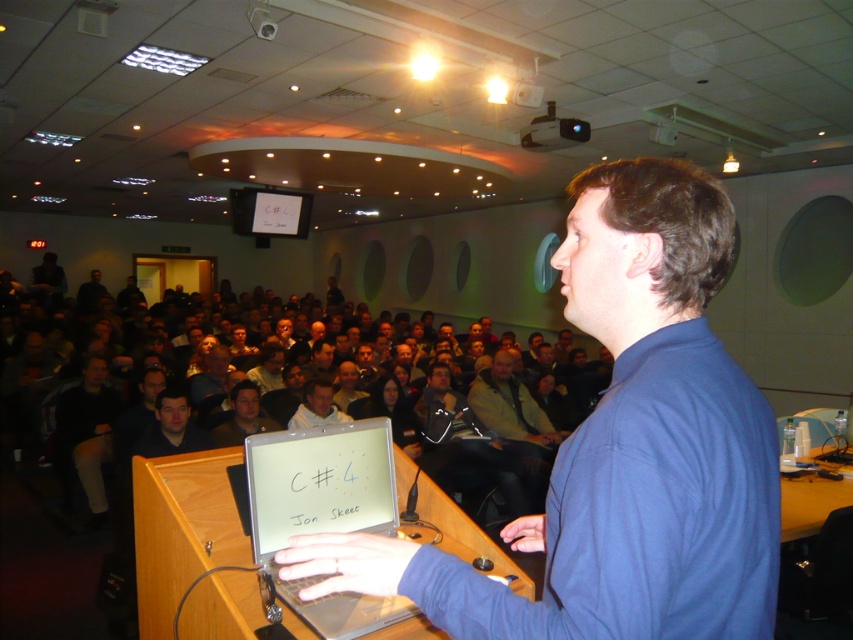
Is point (560, 342) positioned in front of point (254, 403)?

No, it is not.

Image resolution: width=853 pixels, height=640 pixels. Identify the location of dark gray fabric crowd at center. pyautogui.click(x=270, y=390).

Between dark brown hair at center and black plastic projector at upper center, which one has more height?

Standing taller between the two is black plastic projector at upper center.

Who is more distant from viewer, (213, 429) or (583, 132)?

Point (583, 132)

Locate an element on the screen. This screenshot has width=853, height=640. dark brown hair at center is located at coordinates (242, 417).

Who is lower down, blue fabric shirt at center or silver metallic laptop at center?

silver metallic laptop at center

Can you confirm if blue fabric shirt at center is bigger than silver metallic laptop at center?

Correct, blue fabric shirt at center is larger in size than silver metallic laptop at center.

In order to click on blue fabric shirt at center in this screenshot , I will do `click(622, 449)`.

I want to click on blue fabric shirt at center, so pos(622,449).